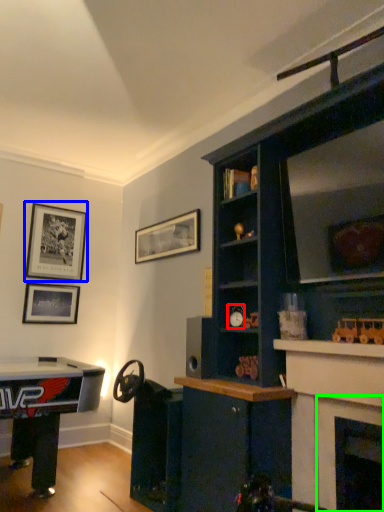
Question: Considering the real-world distances, which object is farthest from toy (highlighted by a red box)? picture frame (highlighted by a blue box) or fireplace (highlighted by a green box)?

Choices:
 (A) picture frame
 (B) fireplace

Answer: (A)